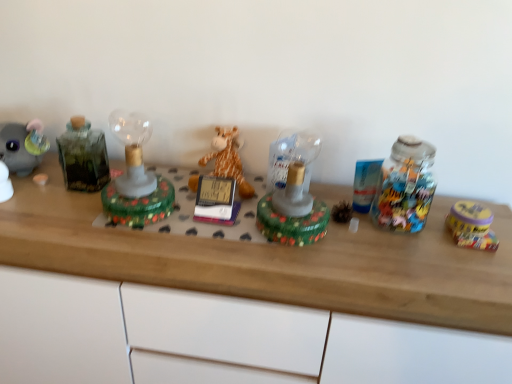
Question: Does green glass lamp at center, the 1th toy in the left-to-right sequence, have a smaller size compared to yellow matte tin at right, acting as the 4th toy starting from the left?

Choices:
 (A) yes
 (B) no

Answer: (B)

Question: From a real-world perspective, is green glass lamp at center, which appears as the fourth toy when viewed from the right, located higher than yellow matte tin at right, acting as the 4th toy starting from the left?

Choices:
 (A) yes
 (B) no

Answer: (A)

Question: Is green glass lamp at center, the 1th toy in the left-to-right sequence, wider than yellow matte tin at right, acting as the 4th toy starting from the left?

Choices:
 (A) no
 (B) yes

Answer: (B)

Question: Can you confirm if green glass lamp at center, which appears as the fourth toy when viewed from the right, is taller than yellow matte tin at right, acting as the 4th toy starting from the left?

Choices:
 (A) no
 (B) yes

Answer: (B)

Question: Is green glass lamp at center, which appears as the fourth toy when viewed from the right, at the right side of yellow matte tin at right, the first toy when ordered from right to left?

Choices:
 (A) no
 (B) yes

Answer: (A)

Question: Is green glass lamp at center, which appears as the fourth toy when viewed from the right, at the left side of yellow matte tin at right, acting as the 4th toy starting from the left?

Choices:
 (A) yes
 (B) no

Answer: (A)

Question: Is wooden desk at center wider than soft plush giraffe at center, the 2th toy viewed from the left?

Choices:
 (A) yes
 (B) no

Answer: (A)

Question: Can you confirm if wooden desk at center is taller than soft plush giraffe at center, the 2th toy viewed from the left?

Choices:
 (A) yes
 (B) no

Answer: (A)

Question: Considering the relative sizes of wooden desk at center and soft plush giraffe at center, arranged as the third toy when viewed from the right, in the image provided, is wooden desk at center smaller than soft plush giraffe at center, arranged as the third toy when viewed from the right,?

Choices:
 (A) yes
 (B) no

Answer: (B)

Question: Does wooden desk at center lie behind soft plush giraffe at center, the 2th toy viewed from the left?

Choices:
 (A) yes
 (B) no

Answer: (B)

Question: Are wooden desk at center and soft plush giraffe at center, the 2th toy viewed from the left, located far from each other?

Choices:
 (A) no
 (B) yes

Answer: (A)

Question: Is wooden desk at center in contact with soft plush giraffe at center, arranged as the third toy when viewed from the right?

Choices:
 (A) no
 (B) yes

Answer: (A)

Question: Considering the relative sizes of wooden desk at center and yellow matte tin at right, the first toy when ordered from right to left, in the image provided, is wooden desk at center wider than yellow matte tin at right, the first toy when ordered from right to left,?

Choices:
 (A) yes
 (B) no

Answer: (A)